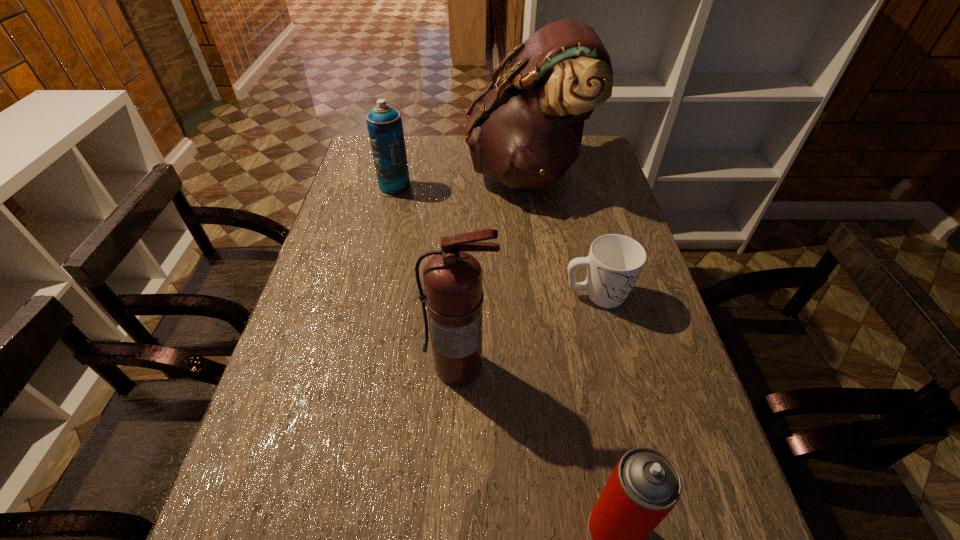
You are a GUI agent. You are given a task and a screenshot of the screen. Output one action in this format:
    pyautogui.click(x=<x>, y=<y>)
    Task: Click on the satchel
    
    Given the screenshot: What is the action you would take?
    pyautogui.click(x=525, y=132)

Locate an element on the screen. the second nearest object is located at coordinates (453, 279).

This screenshot has width=960, height=540. Identify the location of fire extinguisher. (453, 279).

The width and height of the screenshot is (960, 540). I want to click on the leftmost object, so click(x=385, y=128).

At what (x,y) coordinates should I click in order to perform the action: click on the farther aerosol can. Please return your answer as a coordinate pair (x, y). Looking at the image, I should click on (385, 128).

This screenshot has width=960, height=540. In order to click on the shortest object in this screenshot , I will do `click(614, 264)`.

Locate an element on the screen. This screenshot has width=960, height=540. mug is located at coordinates (614, 264).

The height and width of the screenshot is (540, 960). In order to click on blank space located at the front of the satchel with buckles in this screenshot , I will do `click(360, 172)`.

This screenshot has width=960, height=540. What are the coordinates of `vacant space situated at the front of the satchel with buckles` in the screenshot? It's located at (412, 172).

This screenshot has width=960, height=540. What are the coordinates of `vacant space located 0.160m at the front of the satchel with buckles` in the screenshot? It's located at (420, 172).